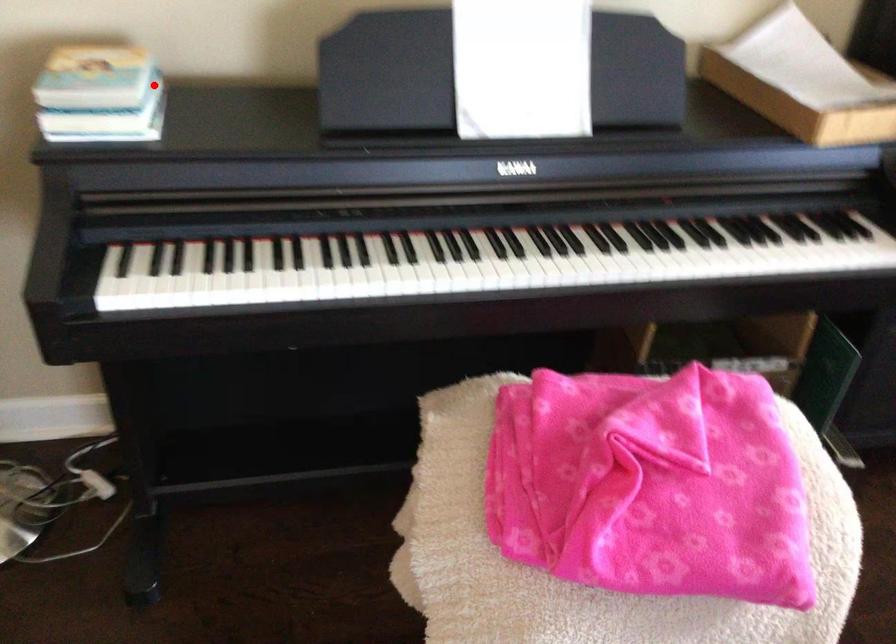
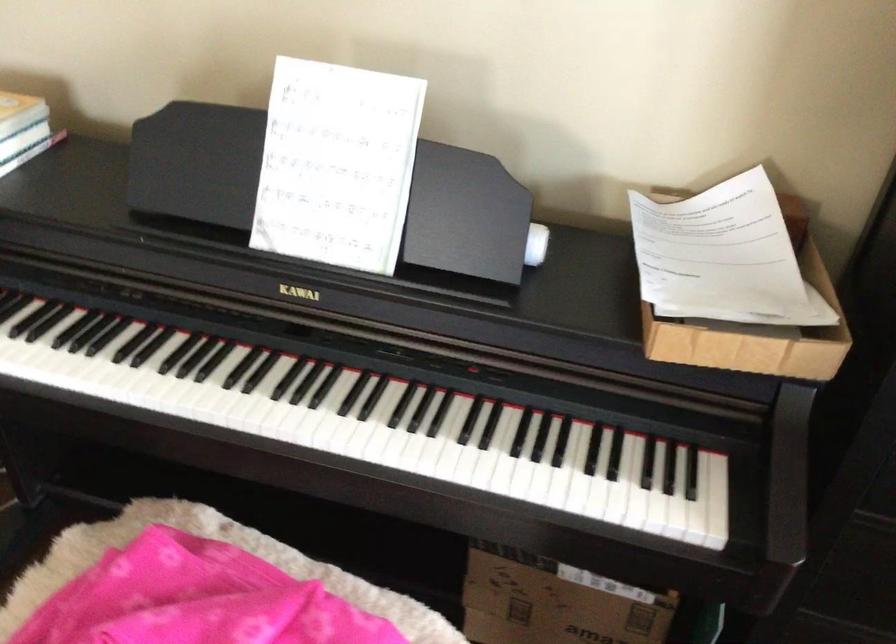
Find the pixel in the second image that matches the highlighted location in the first image.

(23, 129)